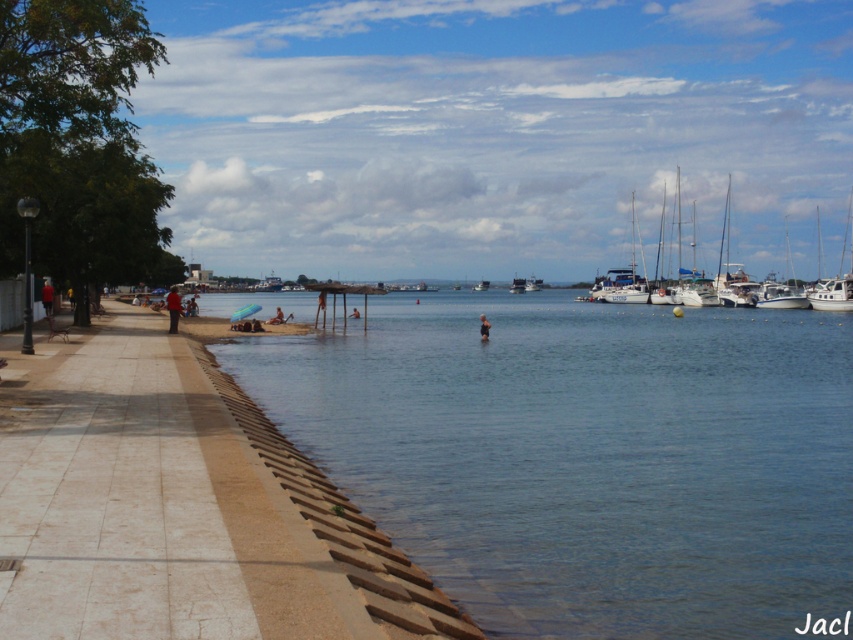
Between point (825, 282) and point (273, 316), which one is positioned in front?

Positioned in front is point (273, 316).

Does point (842, 285) come closer to viewer compared to point (276, 317)?

No, it is behind (276, 317).

You are a GUI agent. You are given a task and a screenshot of the screen. Output one action in this format:
    pyautogui.click(x=<x>, y=<y>)
    Task: Click on the white glossy boat at upper right
    The width and height of the screenshot is (853, 640).
    Given the screenshot: What is the action you would take?
    pyautogui.click(x=834, y=284)

Where is `white glossy boat at upper right`? white glossy boat at upper right is located at coordinates (834, 284).

Who is more distant from viewer, (840, 300) or (784, 292)?

Positioned behind is point (784, 292).

Is the position of white glossy boat at upper right less distant than that of white glossy sailboat at upper right?

Yes, white glossy boat at upper right is closer to the viewer.

Which is behind, point (844, 292) or point (785, 232)?

The point (785, 232) is behind.

Image resolution: width=853 pixels, height=640 pixels. What are the coordinates of `white glossy boat at upper right` in the screenshot? It's located at (834, 284).

Does point (666, 620) lie in front of point (485, 284)?

That is True.

Is clear blue water at lower left shorter than white glossy boat at center?

No.

Between point (715, 472) and point (482, 289), which one is positioned behind?

The point (482, 289) is behind.

Locate an element on the screen. clear blue water at lower left is located at coordinates (587, 456).